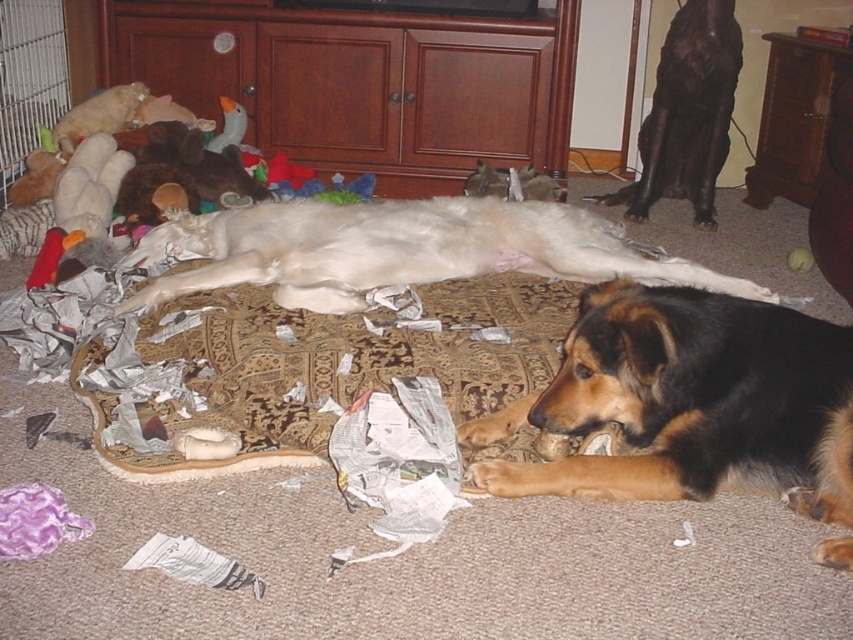
You are a dog trainer assessing the dogs in the image. Which dog would you recommend for a family looking for a larger guard dog, the brown fur dog at center or the white fur dog at center?

The white fur dog at center is larger than the brown fur dog at center, so it would be more suitable for a family looking for a larger guard dog.

You are a dog trainer assessing the space in a room where two dogs are present. The brown fur dog at center and the white fur dog at center are both in the same area. Based on their sizes, which dog would require more space to move comfortably?

The white fur dog at center requires more space to move comfortably because its width is greater than the brown fur dog at center.